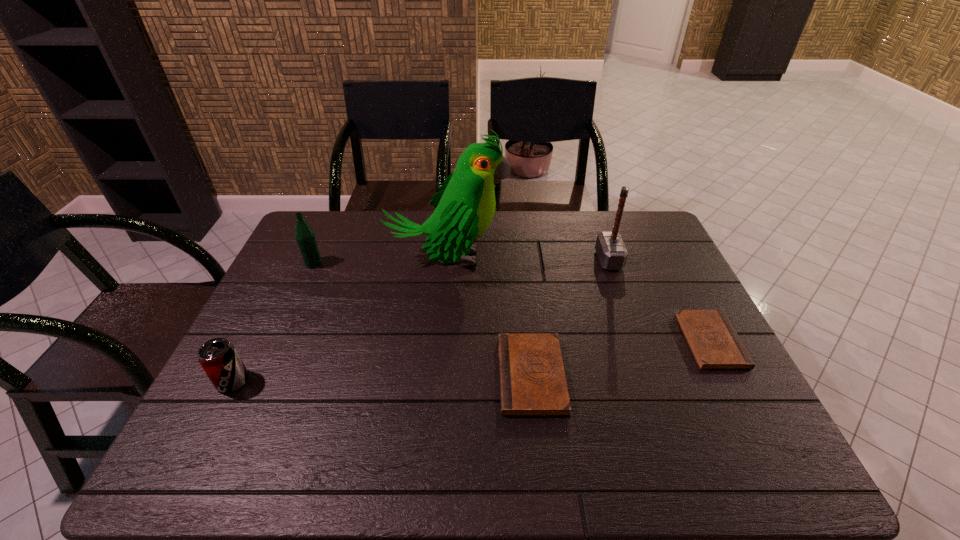
In the image, there is a desktop. Where is `vacant space at the left edge`? The image size is (960, 540). vacant space at the left edge is located at coordinates (294, 273).

Locate an element on the screen. This screenshot has height=540, width=960. vacant region at the right edge of the desktop is located at coordinates (653, 279).

I want to click on free space at the far right corner, so click(632, 238).

At what (x,y) coordinates should I click in order to perform the action: click on vacant region at the near right corner of the desktop. Please return your answer as a coordinate pair (x, y). This screenshot has height=540, width=960. Looking at the image, I should click on (737, 416).

At what (x,y) coordinates should I click in order to perform the action: click on free space between the shorter diary and the bottle. Please return your answer as a coordinate pair (x, y). Looking at the image, I should click on (513, 302).

You are a GUI agent. You are given a task and a screenshot of the screen. Output one action in this format:
    pyautogui.click(x=<x>, y=<y>)
    Task: Click on the empty space that is in between the second object from left to right and the shorter diary
    
    Given the screenshot: What is the action you would take?
    pyautogui.click(x=513, y=302)

Where is `free space between the soda can and the taller diary`? free space between the soda can and the taller diary is located at coordinates click(x=382, y=379).

Find the location of a particular element. This screenshot has height=540, width=960. free point between the parakeet and the taller diary is located at coordinates (489, 317).

The width and height of the screenshot is (960, 540). I want to click on empty space between the right diary and the tallest object, so click(579, 300).

Identify the location of free space between the soda can and the right diary. (472, 361).